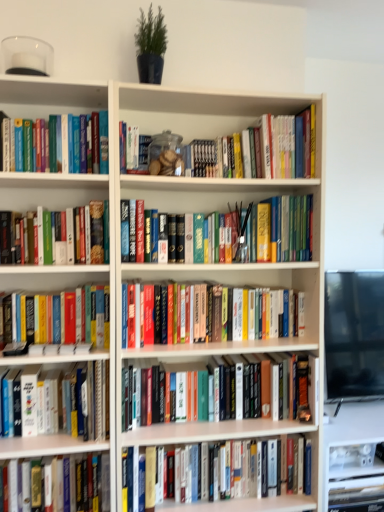
Question: Is hardcover book at center, positioned as the third book in bottom-to-top order, at the left side of white matte bookcase at center?

Choices:
 (A) no
 (B) yes

Answer: (A)

Question: Considering the relative sizes of hardcover book at center, positioned as the third book in bottom-to-top order, and white matte bookcase at center in the image provided, is hardcover book at center, positioned as the third book in bottom-to-top order, smaller than white matte bookcase at center?

Choices:
 (A) yes
 (B) no

Answer: (A)

Question: From a real-world perspective, is hardcover book at center, the 7th book in the top-to-bottom sequence, located higher than white matte bookcase at center?

Choices:
 (A) yes
 (B) no

Answer: (B)

Question: Is hardcover book at center, the 7th book in the top-to-bottom sequence, positioned behind white matte bookcase at center?

Choices:
 (A) no
 (B) yes

Answer: (B)

Question: Is hardcover book at center, the 7th book in the top-to-bottom sequence, aimed at white matte bookcase at center?

Choices:
 (A) no
 (B) yes

Answer: (B)

Question: Is hardcover book at center, the 2th book in the bottom-to-top sequence, spatially inside hardcover book at lower left, marked as the 9th book in a top-to-bottom arrangement, or outside of it?

Choices:
 (A) inside
 (B) outside

Answer: (B)

Question: Is hardcover book at center, which appears as the 8th book when viewed from the top, wider or thinner than hardcover book at lower left, the first book in the bottom-to-top sequence?

Choices:
 (A) wide
 (B) thin

Answer: (B)

Question: In terms of size, does hardcover book at center, which appears as the 8th book when viewed from the top, appear bigger or smaller than hardcover book at lower left, marked as the 9th book in a top-to-bottom arrangement?

Choices:
 (A) small
 (B) big

Answer: (A)

Question: From the image's perspective, relative to hardcover book at lower left, marked as the 9th book in a top-to-bottom arrangement, is hardcover book at center, which appears as the 8th book when viewed from the top, above or below?

Choices:
 (A) below
 (B) above

Answer: (B)

Question: Does point (112, 449) appear closer or farther from the camera than point (54, 487)?

Choices:
 (A) closer
 (B) farther

Answer: (A)

Question: Is white matte bookcase at center wider or thinner than hardcover book at lower left, marked as the 9th book in a top-to-bottom arrangement?

Choices:
 (A) wide
 (B) thin

Answer: (A)

Question: Is white matte bookcase at center in front of or behind hardcover book at lower left, marked as the 9th book in a top-to-bottom arrangement, in the image?

Choices:
 (A) front
 (B) behind

Answer: (A)

Question: Is white matte bookcase at center taller or shorter than hardcover book at lower left, marked as the 9th book in a top-to-bottom arrangement?

Choices:
 (A) tall
 (B) short

Answer: (A)

Question: Considering the positions of point (41, 370) and point (279, 218), is point (41, 370) closer or farther from the camera than point (279, 218)?

Choices:
 (A) farther
 (B) closer

Answer: (B)

Question: In terms of width, does white matte bookcase at center look wider or thinner when compared to hardcover book at center, which is counted as the eighth book, starting from the bottom?

Choices:
 (A) thin
 (B) wide

Answer: (B)